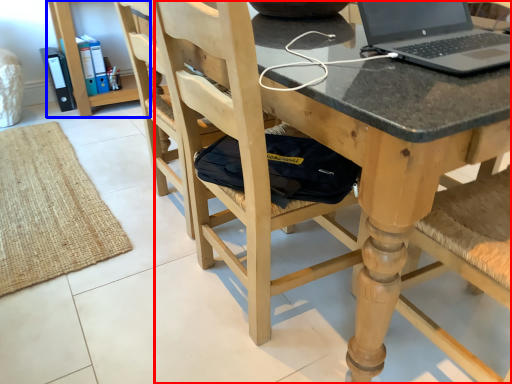
Question: Which of the following is the farthest to the observer, chair (highlighted by a red box) or bookshelf (highlighted by a blue box)?

Choices:
 (A) chair
 (B) bookshelf

Answer: (B)